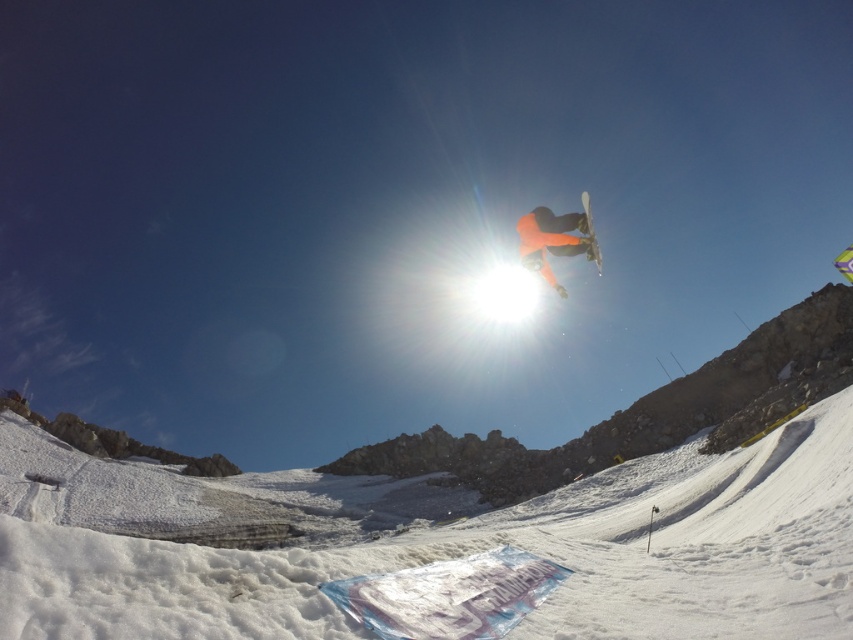
Who is more distant from viewer, (219, 627) or (544, 252)?

Point (544, 252)

Where is `white powdery snow at center`? The image size is (853, 640). white powdery snow at center is located at coordinates (469, 516).

Does white powdery snow at center have a smaller size compared to white matte snowboard at center?

Actually, white powdery snow at center might be larger than white matte snowboard at center.

Between white powdery snow at center and white matte snowboard at center, which one appears on the left side from the viewer's perspective?

white powdery snow at center

What are the coordinates of `white powdery snow at center` in the screenshot? It's located at (469, 516).

Does orange matte snowboarder at center appear on the left side of white matte snowboard at center?

Yes, orange matte snowboarder at center is to the left of white matte snowboard at center.

Find the location of a particular element. Image resolution: width=853 pixels, height=640 pixels. orange matte snowboarder at center is located at coordinates (556, 237).

Find the location of a particular element. orange matte snowboarder at center is located at coordinates (556, 237).